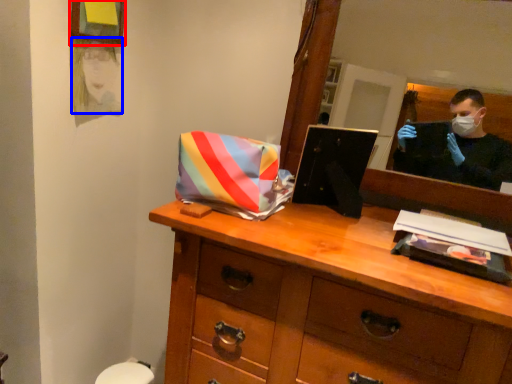
Question: Among these objects, which one is nearest to the camera, picture frame (highlighted by a red box) or person (highlighted by a blue box)?

Choices:
 (A) picture frame
 (B) person

Answer: (A)